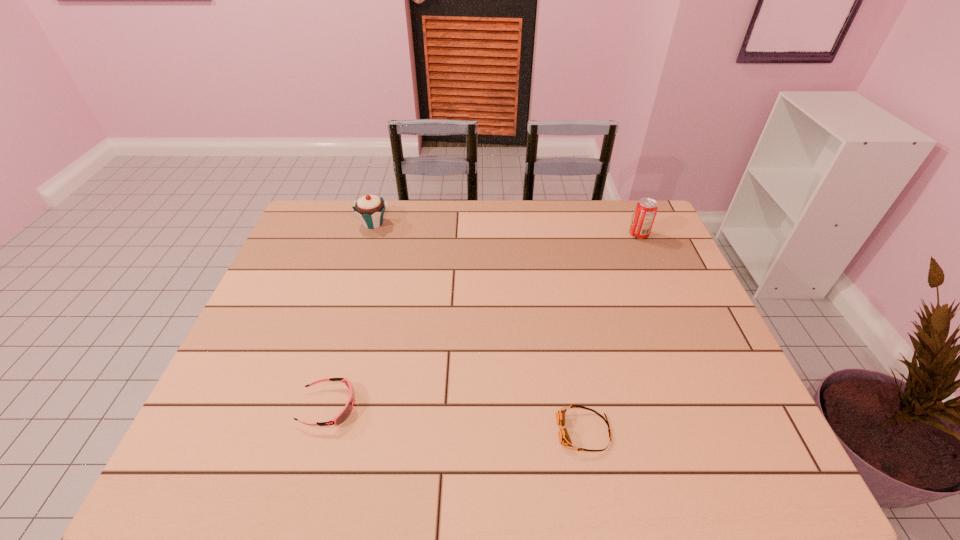
At what (x,y) coordinates should I click in order to perform the action: click on vacant space that is in between the right goggles and the left goggles. Please return your answer as a coordinate pair (x, y). This screenshot has height=540, width=960. Looking at the image, I should click on (456, 418).

Find the location of `vacant space in between the rightmost object and the right goggles`. vacant space in between the rightmost object and the right goggles is located at coordinates [x=612, y=333].

Image resolution: width=960 pixels, height=540 pixels. In order to click on vacant area that lies between the cupcake and the right goggles in this screenshot , I will do `click(478, 327)`.

Find the location of a particular element. vacant space that is in between the soda and the second object from right to left is located at coordinates (612, 333).

The width and height of the screenshot is (960, 540). Identify the location of vacant space that is in between the cupcake and the left goggles. (350, 315).

You are a GUI agent. You are given a task and a screenshot of the screen. Output one action in this format:
    pyautogui.click(x=<x>, y=<y>)
    Task: Click on the empty location between the left goggles and the cupcake
    
    Given the screenshot: What is the action you would take?
    pyautogui.click(x=350, y=315)

I want to click on vacant space in between the shorter goggles and the left goggles, so click(x=456, y=418).

This screenshot has width=960, height=540. In order to click on vacant area between the left goggles and the rightmost object in this screenshot , I will do `click(484, 320)`.

This screenshot has height=540, width=960. Find the location of `empty space that is in between the left goggles and the cupcake`. empty space that is in between the left goggles and the cupcake is located at coordinates (350, 315).

Identify the location of free space between the rightmost object and the cupcake. (506, 229).